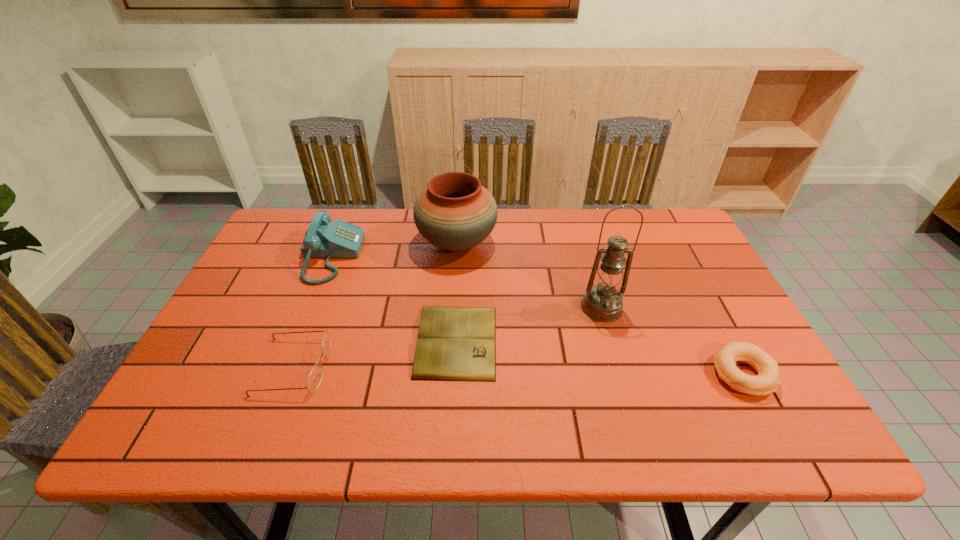
The image size is (960, 540). I want to click on free space at the near edge, so click(x=269, y=411).

Identify the location of vacant area at the left edge of the desktop. (254, 287).

The image size is (960, 540). Find the location of `vacant space at the right edge of the desktop`. vacant space at the right edge of the desktop is located at coordinates (783, 392).

The width and height of the screenshot is (960, 540). I want to click on vacant point at the far left corner, so click(289, 213).

This screenshot has width=960, height=540. I want to click on vacant region at the far right corner of the desktop, so click(x=700, y=247).

Locate an element on the screen. The image size is (960, 540). vacant region at the near right corner of the desktop is located at coordinates (797, 429).

The image size is (960, 540). I want to click on unoccupied area between the book and the spectacles, so click(375, 354).

Locate an element on the screen. The image size is (960, 540). free area in between the rightmost object and the telephone is located at coordinates (537, 315).

Find the location of a particular element. The image size is (960, 540). free area in between the shortest object and the fifth object from left to right is located at coordinates (529, 324).

You are a GUI agent. You are given a task and a screenshot of the screen. Output one action in this format:
    pyautogui.click(x=<x>, y=<y>)
    Task: Click on the blank region between the shortest object and the spectacles
    Image resolution: width=960 pixels, height=540 pixels.
    Given the screenshot: What is the action you would take?
    pyautogui.click(x=375, y=354)